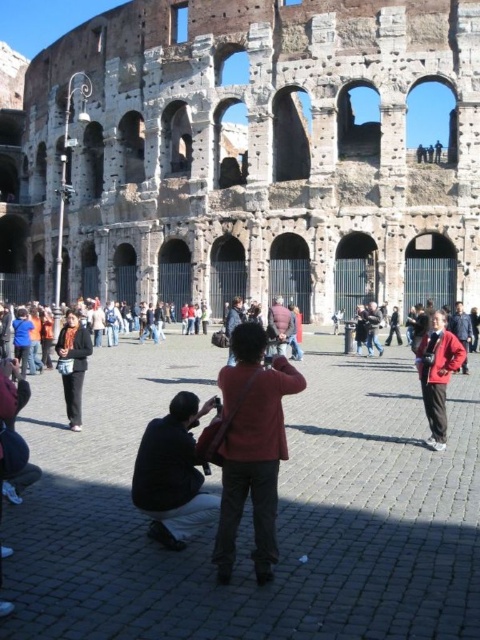
Question: Does red fabric jacket at center have a larger size compared to dark gray fabric jacket at lower left?

Choices:
 (A) yes
 (B) no

Answer: (A)

Question: Can you confirm if red matte jacket at center is bigger than dark gray fabric jacket at lower left?

Choices:
 (A) yes
 (B) no

Answer: (A)

Question: Among these points, which one is nearest to the camera?

Choices:
 (A) (63, 364)
 (B) (180, 428)
 (C) (94, 104)
 (D) (265, 540)

Answer: (D)

Question: Which object is positioned closest to the red matte jacket at center?

Choices:
 (A) dark brown leather jacket at lower center
 (B) red fabric jacket at center
 (C) rustic stone amphitheater at center
 (D) red jacket at center

Answer: (D)

Question: Does dark gray fabric jacket at lower left have a lesser width compared to red jacket at center?

Choices:
 (A) yes
 (B) no

Answer: (A)

Question: Which of the following is the closest to the observer?

Choices:
 (A) dark gray fabric jacket at lower left
 (B) rustic stone amphitheater at center
 (C) dark brown leather jacket at lower center

Answer: (C)